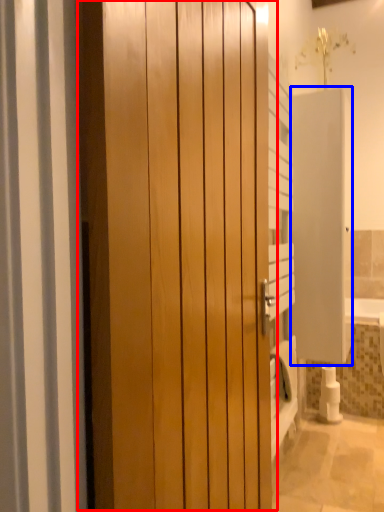
Question: Which object is closer to the camera taking this photo, door (highlighted by a red box) or screen door (highlighted by a blue box)?

Choices:
 (A) door
 (B) screen door

Answer: (A)